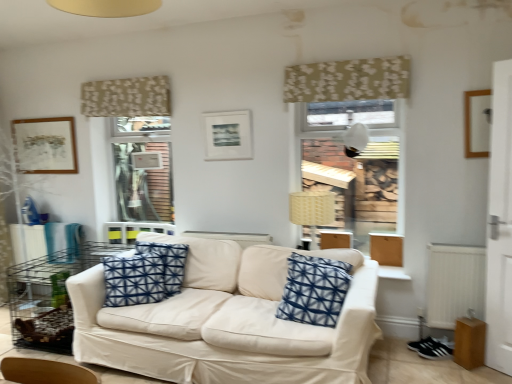
Find the location of a particular element. The image size is (512, 384). wooden picture frame at upper right, the 1th picture frame in the right-to-left sequence is located at coordinates (477, 123).

Locate an element on the screen. This screenshot has height=384, width=512. matte brown picture frame at upper left, placed as the 1th picture frame when sorted from left to right is located at coordinates (45, 145).

I want to click on metal wire table at left, so pyautogui.click(x=51, y=295).

What do you see at coordinates (145, 274) in the screenshot? I see `blue printed cushion at center, the 1th pillow from the left` at bounding box center [145, 274].

Where is `blue printed cushion at center, the 1th pillow from the left`? blue printed cushion at center, the 1th pillow from the left is located at coordinates (145, 274).

Where is `wooden picture frame at upper right, positioned as the 1th picture frame in front-to-back order`? The width and height of the screenshot is (512, 384). wooden picture frame at upper right, positioned as the 1th picture frame in front-to-back order is located at coordinates (477, 123).

Is beige woven lampshade at center positioned far away from metal wire table at left?

Yes, beige woven lampshade at center is far from metal wire table at left.

Does point (330, 192) appear closer or farther from the camera than point (42, 306)?

Clearly, point (330, 192) is closer to the camera than point (42, 306).

Based on the photo, does beige woven lampshade at center lie in front of metal wire table at left?

No, beige woven lampshade at center is further to the viewer.

Measure the distance between beige woven lampshade at center and metal wire table at left.

A distance of 7.20 feet exists between beige woven lampshade at center and metal wire table at left.

I want to click on lamp located on the right of matte black picture frame at center, which is counted as the second picture frame, starting from the back, so click(312, 211).

Is matte black picture frame at center, the second picture frame when ordered from right to left, bigger than beige woven lampshade at center?

Incorrect, matte black picture frame at center, the second picture frame when ordered from right to left, is not larger than beige woven lampshade at center.

Does matte black picture frame at center, the second picture frame when ordered from left to right, come in front of beige woven lampshade at center?

No, it is behind beige woven lampshade at center.

Would you say beige woven lampshade at center is part of matte black picture frame at center, arranged as the second picture frame when viewed from the front,'s contents?

No, beige woven lampshade at center is not inside matte black picture frame at center, arranged as the second picture frame when viewed from the front.

Is blue printed cushion at center, which is the 1th pillow from back to front, not close to metal wire table at left?

No, blue printed cushion at center, which is the 1th pillow from back to front, is not far away from metal wire table at left.

Consider the image. Is blue printed cushion at center, positioned as the second pillow in right-to-left order, closer to camera compared to metal wire table at left?

No, blue printed cushion at center, positioned as the second pillow in right-to-left order, is further to the viewer.

Is blue printed cushion at center, positioned as the second pillow in front-to-back order, oriented away from metal wire table at left?

No, blue printed cushion at center, positioned as the second pillow in front-to-back order, is not facing the opposite direction of metal wire table at left.

Looking at the image, does blue printed cushion at center, which is the 1th pillow from back to front, seem bigger or smaller compared to metal wire table at left?

Clearly, blue printed cushion at center, which is the 1th pillow from back to front, is smaller in size than metal wire table at left.

Does point (291, 285) come behind point (432, 277)?

No.

In the scene shown: Is blue printed cushion at center, marked as the second pillow in a left-to-right arrangement, closer to camera compared to white plastic radiator at lower right?

Yes, it is.

Is blue printed cushion at center, the second pillow in the back-to-front sequence, shorter than white plastic radiator at lower right?

Indeed, blue printed cushion at center, the second pillow in the back-to-front sequence, has a lesser height compared to white plastic radiator at lower right.

Are blue printed cushion at center, which appears as the 1th pillow when viewed from the front, and white plastic radiator at lower right located far from each other?

blue printed cushion at center, which appears as the 1th pillow when viewed from the front, is actually quite close to white plastic radiator at lower right.

From a real-world perspective, is beige woven lampshade at center under matte brown picture frame at upper left, placed as the 1th picture frame when sorted from left to right?

Yes, from a real-world perspective, beige woven lampshade at center is under matte brown picture frame at upper left, placed as the 1th picture frame when sorted from left to right.

Is beige woven lampshade at center closer to camera compared to matte brown picture frame at upper left, which appears as the third picture frame when viewed from the front?

Yes.

Is beige woven lampshade at center with matte brown picture frame at upper left, which appears as the third picture frame when viewed from the front?

beige woven lampshade at center is not next to matte brown picture frame at upper left, which appears as the third picture frame when viewed from the front, and they're not touching.

From the image's perspective, is beige woven lampshade at center beneath matte brown picture frame at upper left, which is counted as the 3th picture frame, starting from the right?

Yes, from the image's perspective, beige woven lampshade at center is beneath matte brown picture frame at upper left, which is counted as the 3th picture frame, starting from the right.

Is beige floral fabric at upper center, which ranks as the 2th curtain in left-to-right order, next to beige woven lampshade at center?

They are not placed beside each other.

In the image, is beige floral fabric at upper center, arranged as the 1th curtain when viewed from the right, on the left side or the right side of beige woven lampshade at center?

Clearly, beige floral fabric at upper center, arranged as the 1th curtain when viewed from the right, is on the right of beige woven lampshade at center in the image.

Does beige floral fabric at upper center, which ranks as the 2th curtain in left-to-right order, contain beige woven lampshade at center?

No, beige woven lampshade at center is not inside beige floral fabric at upper center, which ranks as the 2th curtain in left-to-right order.

Can you confirm if beige floral fabric at upper center, acting as the second curtain starting from the front, is positioned to the right of beige floral fabric at upper center, arranged as the 1th curtain when viewed from the right?

No.

From the image's perspective, is beige floral fabric at upper center, acting as the second curtain starting from the front, over beige floral fabric at upper center, the 1th curtain positioned from the front?

Yes.

Considering the sizes of objects beige floral fabric at upper center, marked as the 2th curtain in a right-to-left arrangement, and beige floral fabric at upper center, which ranks as the 2th curtain in left-to-right order, in the image provided, who is taller, beige floral fabric at upper center, marked as the 2th curtain in a right-to-left arrangement, or beige floral fabric at upper center, which ranks as the 2th curtain in left-to-right order,?

Standing taller between the two is beige floral fabric at upper center, marked as the 2th curtain in a right-to-left arrangement.

You are a GUI agent. You are given a task and a screenshot of the screen. Output one action in this format:
    pyautogui.click(x=<x>, y=<y>)
    Task: Click on the table on the left of beige woven lampshade at center
    
    Given the screenshot: What is the action you would take?
    click(x=51, y=295)

The width and height of the screenshot is (512, 384). Identify the location of lamp below the matte black picture frame at center, which is counted as the second picture frame, starting from the back (from a real-world perspective). pyautogui.click(x=312, y=211).

Which object lies further to the anchor point blue printed cushion at center, the 1th pillow from the left, blue printed cushion at center, which appears as the 1th pillow when viewed from the front, or white plastic radiator at lower right?

The object further to blue printed cushion at center, the 1th pillow from the left, is white plastic radiator at lower right.

Estimate the real-world distances between objects in this image. Which object is further from white plastic radiator at lower right, beige woven lampshade at center or blue printed cushion at center, the 1th pillow from the left?

Based on the image, blue printed cushion at center, the 1th pillow from the left, appears to be further to white plastic radiator at lower right.

Based on their spatial positions, is metal wire table at left or beige woven lampshade at center further from matte black picture frame at center, the second picture frame when ordered from left to right?

metal wire table at left is positioned further to the anchor matte black picture frame at center, the second picture frame when ordered from left to right.

Based on their spatial positions, is matte brown picture frame at upper left, which appears as the third picture frame when viewed from the front, or blue printed cushion at center, which appears as the 1th pillow when viewed from the front, further from blue printed cushion at center, positioned as the second pillow in right-to-left order?

Among the two, matte brown picture frame at upper left, which appears as the third picture frame when viewed from the front, is located further to blue printed cushion at center, positioned as the second pillow in right-to-left order.

From the image, which object appears to be farther from beige floral fabric at upper center, the 1th curtain positioned from the front, beige woven lampshade at center or white fabric couch at center?

white fabric couch at center is further to beige floral fabric at upper center, the 1th curtain positioned from the front.

When comparing their distances from matte black picture frame at center, which is counted as the second picture frame, starting from the back, does white fabric couch at center or blue printed cushion at center, positioned as the second pillow in right-to-left order, seem closer?

blue printed cushion at center, positioned as the second pillow in right-to-left order.

Estimate the real-world distances between objects in this image. Which object is closer to white fabric couch at center, blue printed cushion at center, positioned as the second pillow in front-to-back order, or matte black picture frame at center, the second picture frame when ordered from right to left?

The object closer to white fabric couch at center is blue printed cushion at center, positioned as the second pillow in front-to-back order.

Considering their positions, is beige floral fabric at upper center, acting as the first curtain starting from the left, positioned further to metal wire table at left than wooden picture frame at upper right, the 1th picture frame in the right-to-left sequence?

The object further to metal wire table at left is wooden picture frame at upper right, the 1th picture frame in the right-to-left sequence.

Identify the location of lamp located between white fabric couch at center and wooden picture frame at upper right, the third picture frame when ordered from back to front, in the left-right direction. The height and width of the screenshot is (384, 512). (312, 211).

Where is `curtain between blue printed cushion at center, which is the 1th pillow from back to front, and white plastic radiator at lower right from left to right`? Image resolution: width=512 pixels, height=384 pixels. curtain between blue printed cushion at center, which is the 1th pillow from back to front, and white plastic radiator at lower right from left to right is located at coordinates (348, 80).

Image resolution: width=512 pixels, height=384 pixels. What are the coordinates of `lamp situated between blue printed cushion at center, which is the 1th pillow from back to front, and wooden picture frame at upper right, positioned as the 1th picture frame in front-to-back order, from left to right` in the screenshot? It's located at (312, 211).

The width and height of the screenshot is (512, 384). Identify the location of table between matte brown picture frame at upper left, which appears as the third picture frame when viewed from the front, and beige floral fabric at upper center, which is the 2th curtain from back to front, in the horizontal direction. (51, 295).